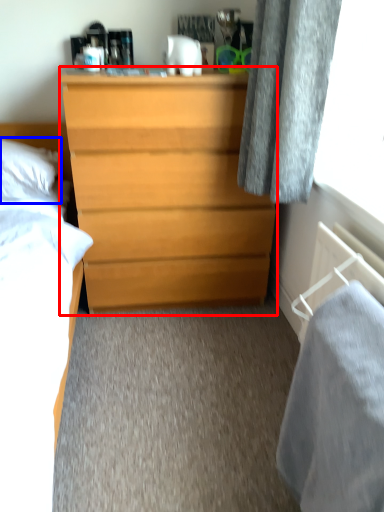
Question: Among these objects, which one is nearest to the camera, chest of drawers (highlighted by a red box) or pillow (highlighted by a blue box)?

Choices:
 (A) chest of drawers
 (B) pillow

Answer: (A)